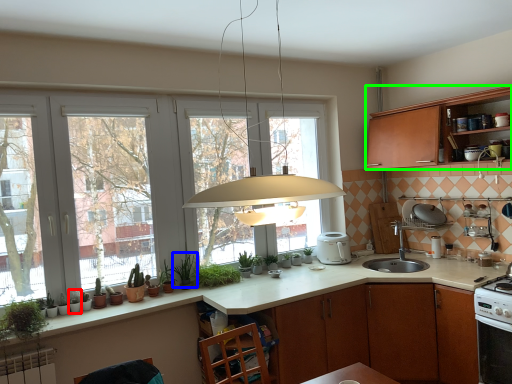
Question: Which object is positioned closest to plant (highlighted by a red box)? Select from plant (highlighted by a blue box) and cabinetry (highlighted by a green box).

Choices:
 (A) plant
 (B) cabinetry

Answer: (A)